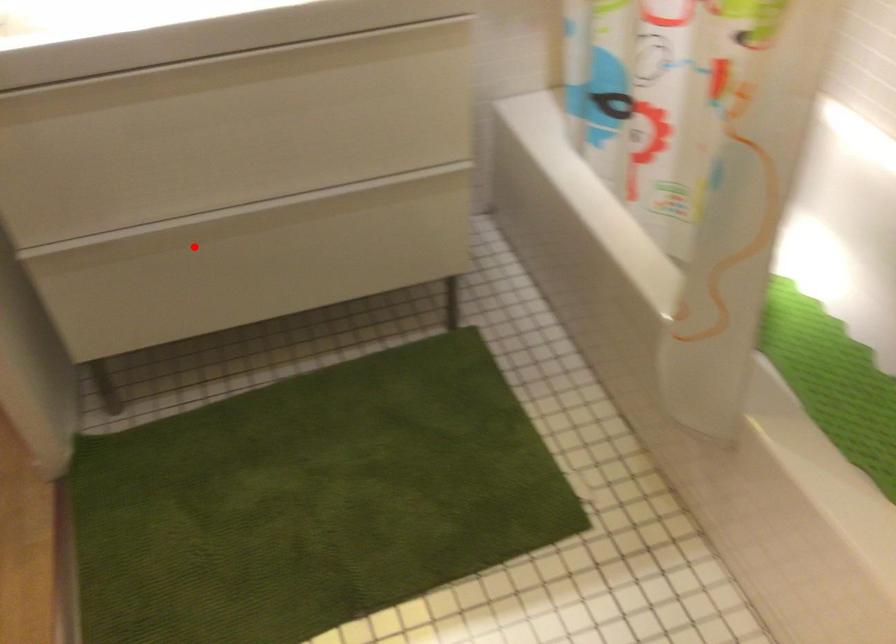
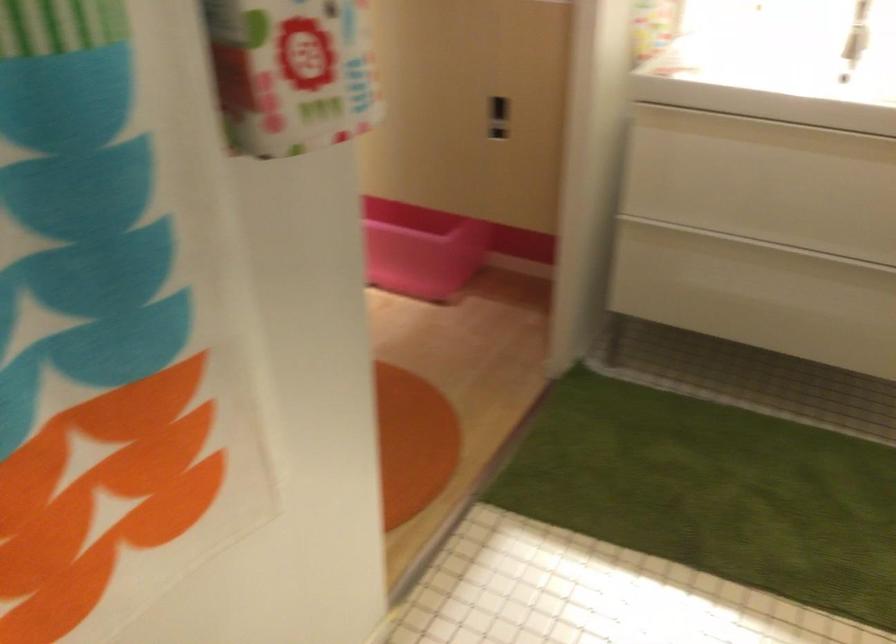
The point at the highlighted location is marked in the first image. Where is the corresponding point in the second image?

(734, 254)